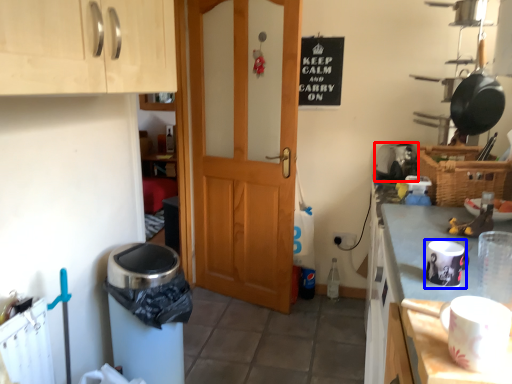
Question: Which of the following is the farthest to the observer, appliance (highlighted by a red box) or appliance (highlighted by a blue box)?

Choices:
 (A) appliance
 (B) appliance

Answer: (A)